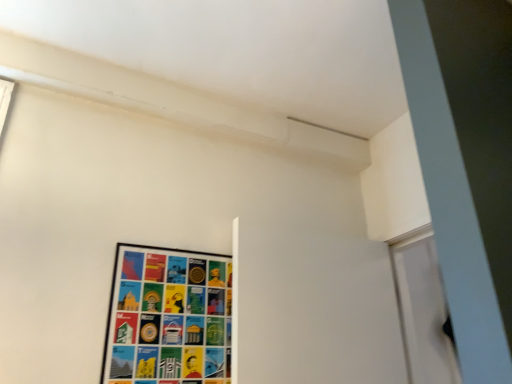
The width and height of the screenshot is (512, 384). What do you see at coordinates (168, 317) in the screenshot?
I see `matte black picture frame at lower left` at bounding box center [168, 317].

Where is `matte black picture frame at lower left`? The width and height of the screenshot is (512, 384). matte black picture frame at lower left is located at coordinates (168, 317).

Where is `matte black picture frame at lower left`? The height and width of the screenshot is (384, 512). matte black picture frame at lower left is located at coordinates (168, 317).